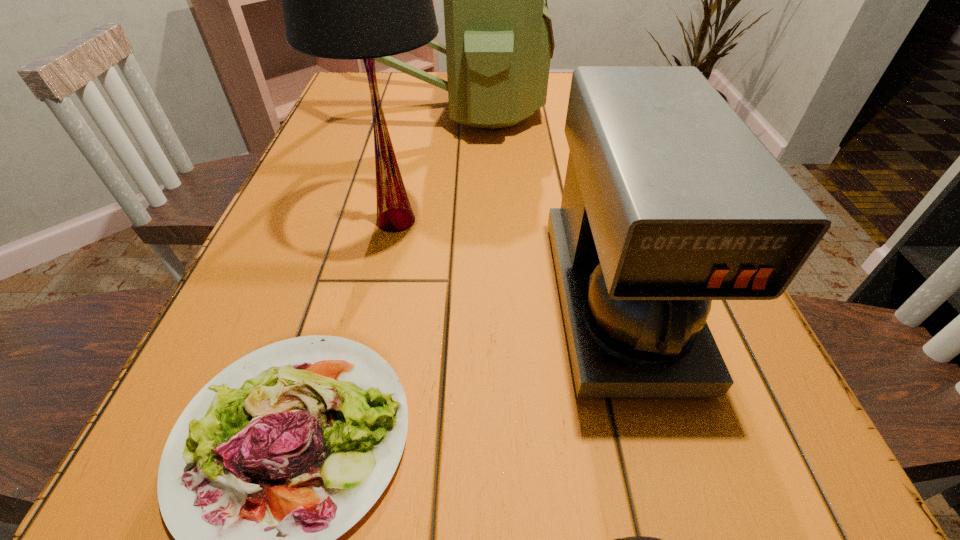
Image resolution: width=960 pixels, height=540 pixels. What are the coordinates of `free space that is in between the coffee maker and the lampshade` in the screenshot? It's located at (507, 260).

At what (x,y) coordinates should I click in order to perform the action: click on object that is the closest one to the farthest object. Please return your answer as a coordinate pair (x, y). Looking at the image, I should click on (348, 0).

At what (x,y) coordinates should I click in order to perform the action: click on object that stands as the third closest to the backpack. Please return your answer as a coordinate pair (x, y). The image size is (960, 540). Looking at the image, I should click on (255, 529).